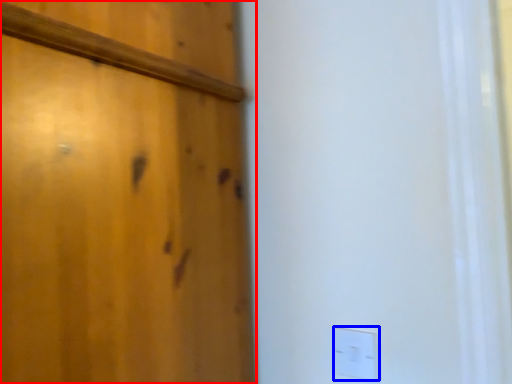
Question: Which of the following is the closest to the observer, door (highlighted by a red box) or light switch (highlighted by a blue box)?

Choices:
 (A) door
 (B) light switch

Answer: (A)